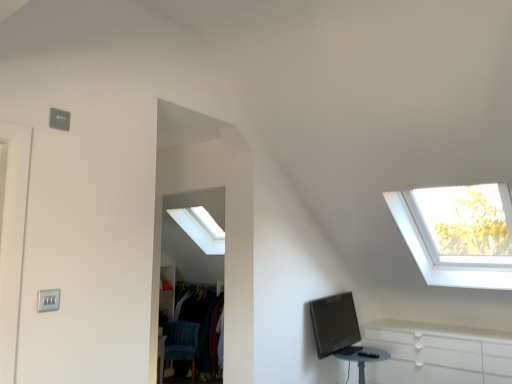
Question: Is velvet blue swivel chair at lower left surrounding black glossy computer monitor at lower right?

Choices:
 (A) yes
 (B) no

Answer: (B)

Question: Is velvet blue swivel chair at lower left touching black glossy computer monitor at lower right?

Choices:
 (A) yes
 (B) no

Answer: (B)

Question: Is velvet blue swivel chair at lower left bigger than black glossy computer monitor at lower right?

Choices:
 (A) yes
 (B) no

Answer: (A)

Question: From the image's perspective, is velvet blue swivel chair at lower left located above black glossy computer monitor at lower right?

Choices:
 (A) yes
 (B) no

Answer: (B)

Question: Is velvet blue swivel chair at lower left thinner than black glossy computer monitor at lower right?

Choices:
 (A) no
 (B) yes

Answer: (A)

Question: Is velvet blue swivel chair at lower left inside or outside of satin silver switch at lower left?

Choices:
 (A) outside
 (B) inside

Answer: (A)

Question: Is point (192, 329) closer or farther from the camera than point (48, 291)?

Choices:
 (A) closer
 (B) farther

Answer: (B)

Question: From the image's perspective, is velvet blue swivel chair at lower left above or below satin silver switch at lower left?

Choices:
 (A) above
 (B) below

Answer: (B)

Question: Is velvet blue swivel chair at lower left taller or shorter than satin silver switch at lower left?

Choices:
 (A) tall
 (B) short

Answer: (A)

Question: Based on their sizes in the image, would you say velvet blue swivel chair at lower left is bigger or smaller than black glossy computer monitor at lower right?

Choices:
 (A) big
 (B) small

Answer: (A)

Question: Is velvet blue swivel chair at lower left taller or shorter than black glossy computer monitor at lower right?

Choices:
 (A) tall
 (B) short

Answer: (A)

Question: From the image's perspective, is velvet blue swivel chair at lower left positioned above or below black glossy computer monitor at lower right?

Choices:
 (A) below
 (B) above

Answer: (A)

Question: From a real-world perspective, is velvet blue swivel chair at lower left positioned above or below black glossy computer monitor at lower right?

Choices:
 (A) below
 (B) above

Answer: (A)

Question: Is black glossy computer monitor at lower right inside the boundaries of matte black table at lower right, or outside?

Choices:
 (A) inside
 (B) outside

Answer: (B)

Question: From a real-world perspective, relative to matte black table at lower right, is black glossy computer monitor at lower right vertically above or below?

Choices:
 (A) below
 (B) above

Answer: (B)